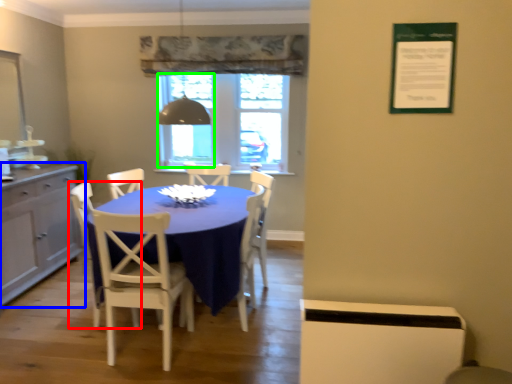
Question: Which object is positioned farthest from chair (highlighted by a red box)? Select from cabinetry (highlighted by a blue box) and window screen (highlighted by a green box).

Choices:
 (A) cabinetry
 (B) window screen

Answer: (B)